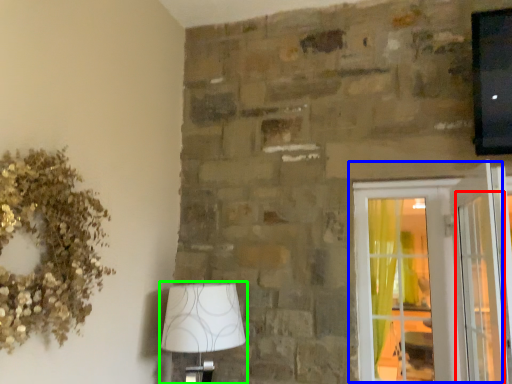
Question: Which object is the farthest from screen door (highlighted by a red box)? Choose among these: window (highlighted by a blue box) or lamp (highlighted by a green box).

Choices:
 (A) window
 (B) lamp

Answer: (B)